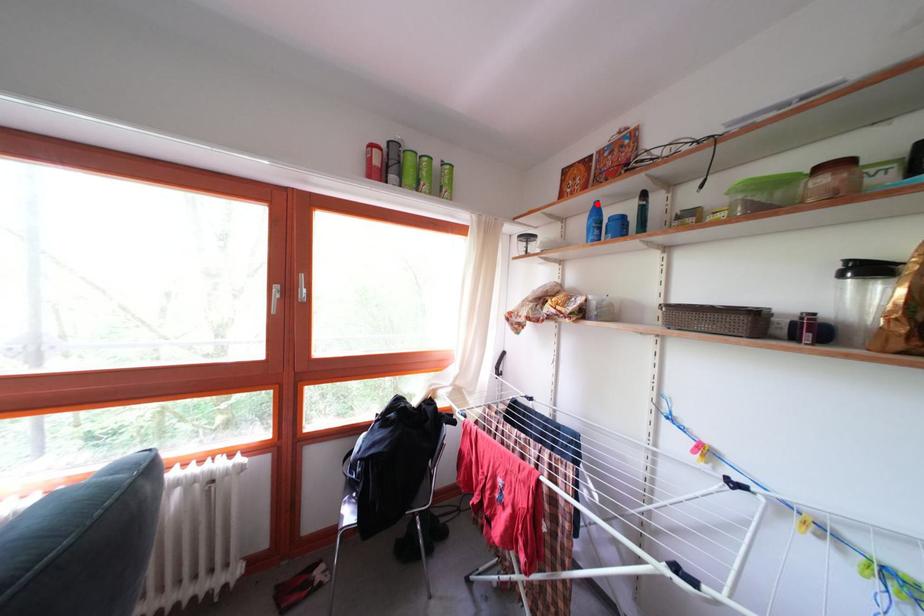
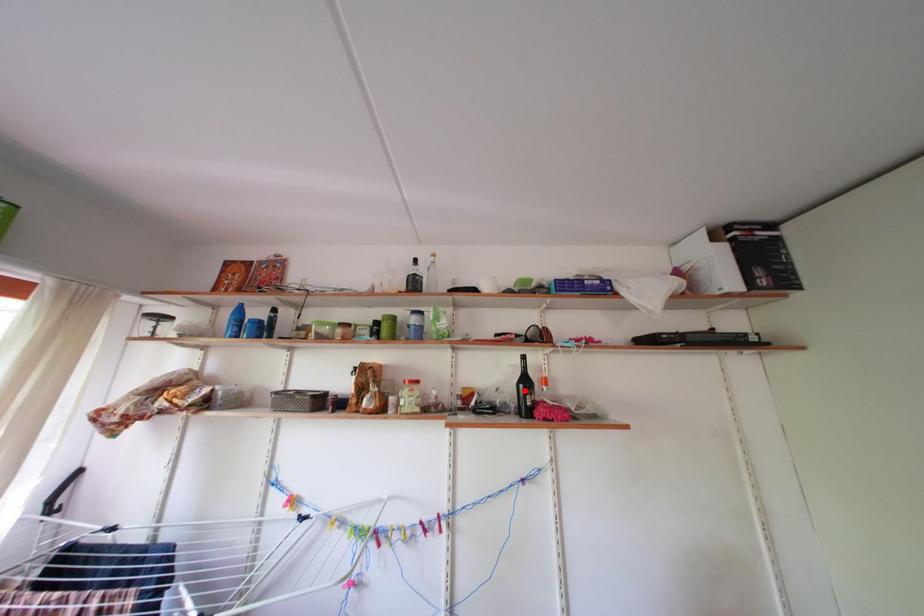
I am providing you with two images of the same scene from different viewpoints. A red point is marked on the first image and another point is marked on the second image. Are the points marked in image1 and image2 representing the same 3D position?

No